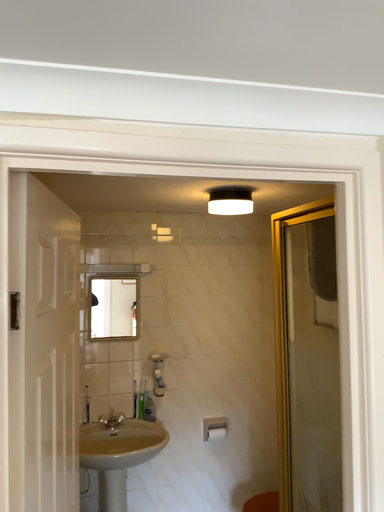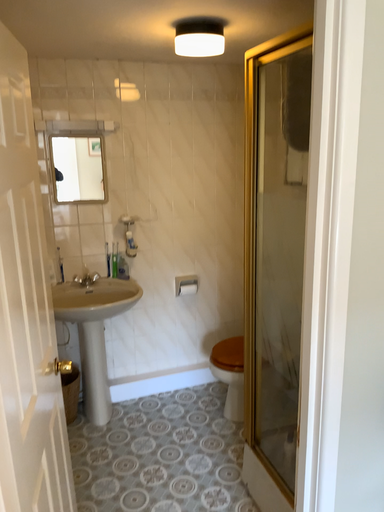
Question: How did the camera likely rotate when shooting the video?

Choices:
 (A) rotated downward
 (B) rotated upward

Answer: (A)